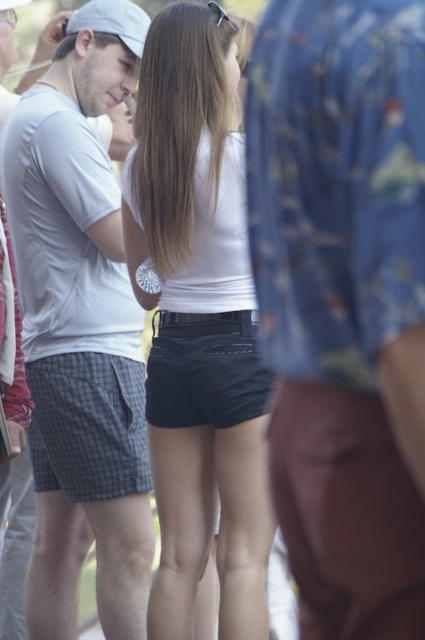
Question: Which of the following is the closest to the observer?

Choices:
 (A) (192, 248)
 (B) (96, 26)
 (C) (334, 397)

Answer: (C)

Question: Which is farther from the white t-shirt at center?

Choices:
 (A) black matte shorts at center
 (B) floral fabric shirt at center

Answer: (B)

Question: Can you confirm if black matte shorts at center is positioned to the left of white matte baseball cap at upper left?

Choices:
 (A) yes
 (B) no

Answer: (B)

Question: Which point is farther from the camera taking this photo?

Choices:
 (A) (78, 22)
 (B) (244, 600)
 (C) (299, 65)
 (D) (142, 541)

Answer: (D)

Question: Can you confirm if white t-shirt at center is thinner than white matte baseball cap at upper left?

Choices:
 (A) yes
 (B) no

Answer: (B)

Question: Is the position of floral fabric shirt at center less distant than that of black matte shorts at center?

Choices:
 (A) no
 (B) yes

Answer: (B)